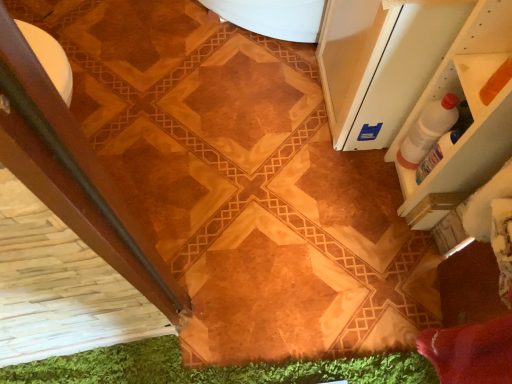
At what (x,y) coordinates should I click in order to perform the action: click on white glossy screen door at upper right. Please return your answer as a coordinate pair (x, y). Image resolution: width=512 pixels, height=384 pixels. Looking at the image, I should click on (405, 70).

What do you see at coordinates (405, 70) in the screenshot? I see `white glossy screen door at upper right` at bounding box center [405, 70].

What is the approximate width of white plastic bottle at upper right?

It is 2.84 inches.

The image size is (512, 384). I want to click on white plastic bottle at upper right, so click(x=428, y=130).

This screenshot has height=384, width=512. What do you see at coordinates (428, 130) in the screenshot? I see `white plastic bottle at upper right` at bounding box center [428, 130].

Find the location of `white glossy screen door at upper right`. white glossy screen door at upper right is located at coordinates (405, 70).

In the scene shown: Is white glossy screen door at upper right at the right side of white plastic bottle at upper right?

Incorrect, white glossy screen door at upper right is not on the right side of white plastic bottle at upper right.

Which object is closer to the camera, white glossy screen door at upper right or white plastic bottle at upper right?

white glossy screen door at upper right.

Considering the positions of points (415, 59) and (431, 103), is point (415, 59) closer to camera compared to point (431, 103)?

Yes, point (415, 59) is closer to viewer.

From the image's perspective, is white glossy screen door at upper right on white plastic bottle at upper right?

Correct, white glossy screen door at upper right appears higher than white plastic bottle at upper right in the image.

From a real-world perspective, is white glossy screen door at upper right beneath white plastic bottle at upper right?

Incorrect, from a real-world perspective, white glossy screen door at upper right is higher than white plastic bottle at upper right.

Consider the image. Considering the sizes of objects white glossy screen door at upper right and white plastic bottle at upper right in the image provided, who is wider, white glossy screen door at upper right or white plastic bottle at upper right?

Wider between the two is white glossy screen door at upper right.

Does white glossy screen door at upper right have a lesser height compared to white plastic bottle at upper right?

No.

Is white glossy screen door at upper right smaller than white plastic bottle at upper right?

No.

Is white glossy screen door at upper right inside or outside of white plastic bottle at upper right?

white glossy screen door at upper right is not enclosed by white plastic bottle at upper right.

Is white glossy screen door at upper right far from white plastic bottle at upper right?

white glossy screen door at upper right is near white plastic bottle at upper right, not far away.

Is white glossy screen door at upper right oriented away from white plastic bottle at upper right?

No, white glossy screen door at upper right is not facing the opposite direction of white plastic bottle at upper right.

How different are the orientations of white glossy screen door at upper right and white plastic bottle at upper right in degrees?

white glossy screen door at upper right and white plastic bottle at upper right are facing 1.83 degrees away from each other.

Locate an element on the screen. The image size is (512, 384). bottle behind the white glossy screen door at upper right is located at coordinates tap(428, 130).

Between white plastic bottle at upper right and white glossy screen door at upper right, which one appears on the right side from the viewer's perspective?

white plastic bottle at upper right is more to the right.

Is white plastic bottle at upper right in front of or behind white glossy screen door at upper right in the image?

white plastic bottle at upper right is behind white glossy screen door at upper right.

Which is closer, (424, 121) or (381, 147)?

Point (424, 121) appears to be closer to the viewer than point (381, 147).

From the image's perspective, would you say white plastic bottle at upper right is shown under white glossy screen door at upper right?

Indeed, from the image's perspective, white plastic bottle at upper right is shown beneath white glossy screen door at upper right.

From a real-world perspective, which object rests below the other?

white plastic bottle at upper right is physically lower.

Does white plastic bottle at upper right have a greater width compared to white glossy screen door at upper right?

No.

Can you confirm if white plastic bottle at upper right is shorter than white glossy screen door at upper right?

Yes.

Based on their sizes in the image, would you say white plastic bottle at upper right is bigger or smaller than white glossy screen door at upper right?

In the image, white plastic bottle at upper right appears to be smaller than white glossy screen door at upper right.

Is white plastic bottle at upper right spatially inside white glossy screen door at upper right, or outside of it?

white plastic bottle at upper right is not inside white glossy screen door at upper right, it's outside.

Does white plastic bottle at upper right touch white glossy screen door at upper right?

They are not placed beside each other.

Is white plastic bottle at upper right oriented away from white glossy screen door at upper right?

No, white plastic bottle at upper right is not facing the opposite direction of white glossy screen door at upper right.

I want to click on bottle located underneath the white glossy screen door at upper right (from a real-world perspective), so click(428, 130).

Find the location of a particular element. bottle on the right side of white glossy screen door at upper right is located at coordinates (428, 130).

Identify the location of bottle that appears below the white glossy screen door at upper right (from the image's perspective). The image size is (512, 384). (428, 130).